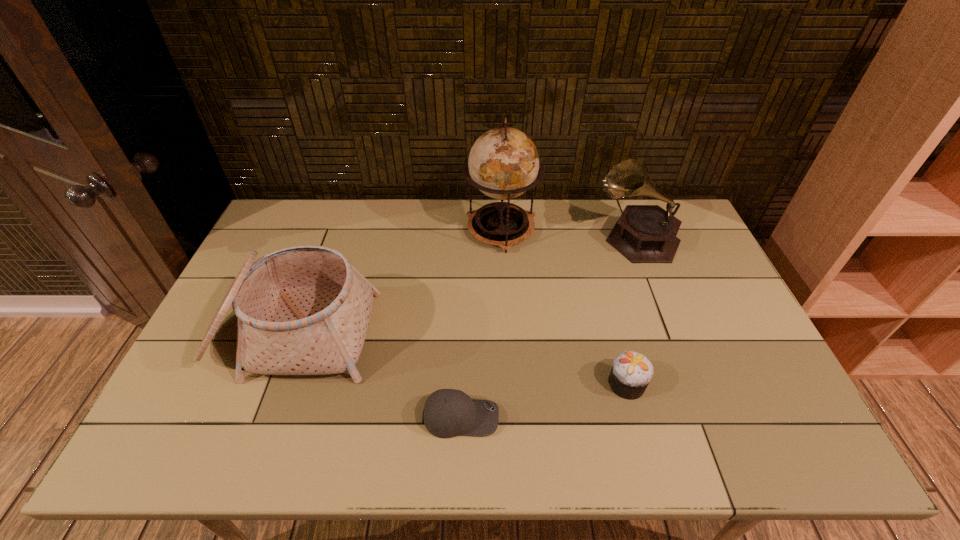
Identify the location of free spot between the phonograph record and the globe. (569, 234).

What are the coordinates of `free space that is in between the globe and the cupcake` in the screenshot? It's located at (564, 307).

Find the location of a particular element. This screenshot has width=960, height=540. object that is the second nearest to the cupcake is located at coordinates (644, 233).

Find the location of a particular element. The image size is (960, 540). the third closest object to the globe is located at coordinates (631, 373).

Identify the location of vacant region that satisfies the following two spatial constraints: 1. at the center of the tallest object; 2. on the front brim of the shortest object. (511, 417).

The image size is (960, 540). I want to click on vacant space that satisfies the following two spatial constraints: 1. with the lid open on the basket; 2. on the left side of the cupcake, so click(x=274, y=383).

This screenshot has height=540, width=960. I want to click on vacant region that satisfies the following two spatial constraints: 1. at the center of the tallest object; 2. on the front brim of the baseball cap, so click(x=511, y=417).

Find the location of a particular element. vacant area that satisfies the following two spatial constraints: 1. with the lid open on the cupcake; 2. on the left side of the basket is located at coordinates (274, 383).

Find the location of a particular element. The width and height of the screenshot is (960, 540). blank area in the image that satisfies the following two spatial constraints: 1. at the center of the tallest object; 2. on the left side of the cupcake is located at coordinates (509, 383).